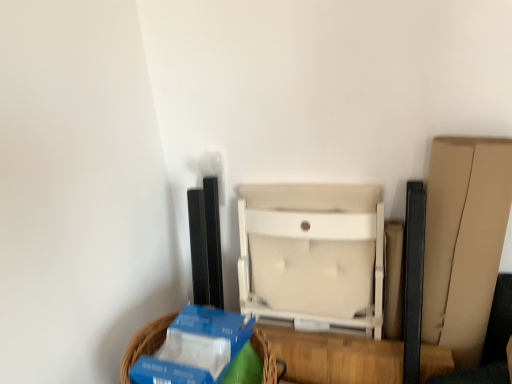
Question: In terms of height, does blue cardboard basket at lower left look taller or shorter compared to beige fabric chair at center?

Choices:
 (A) short
 (B) tall

Answer: (A)

Question: Would you say blue cardboard basket at lower left is to the left or to the right of beige fabric chair at center in the picture?

Choices:
 (A) left
 (B) right

Answer: (A)

Question: Based on their sizes in the image, would you say blue cardboard basket at lower left is bigger or smaller than beige fabric chair at center?

Choices:
 (A) big
 (B) small

Answer: (B)

Question: Looking at the image, does beige fabric chair at center seem bigger or smaller compared to blue cardboard basket at lower left?

Choices:
 (A) big
 (B) small

Answer: (A)

Question: In the image, is beige fabric chair at center positioned in front of or behind blue cardboard basket at lower left?

Choices:
 (A) behind
 (B) front

Answer: (A)

Question: Considering the positions of beige fabric chair at center and blue cardboard basket at lower left in the image, is beige fabric chair at center taller or shorter than blue cardboard basket at lower left?

Choices:
 (A) short
 (B) tall

Answer: (B)

Question: Considering the positions of point (275, 273) and point (135, 344), is point (275, 273) closer or farther from the camera than point (135, 344)?

Choices:
 (A) farther
 (B) closer

Answer: (A)